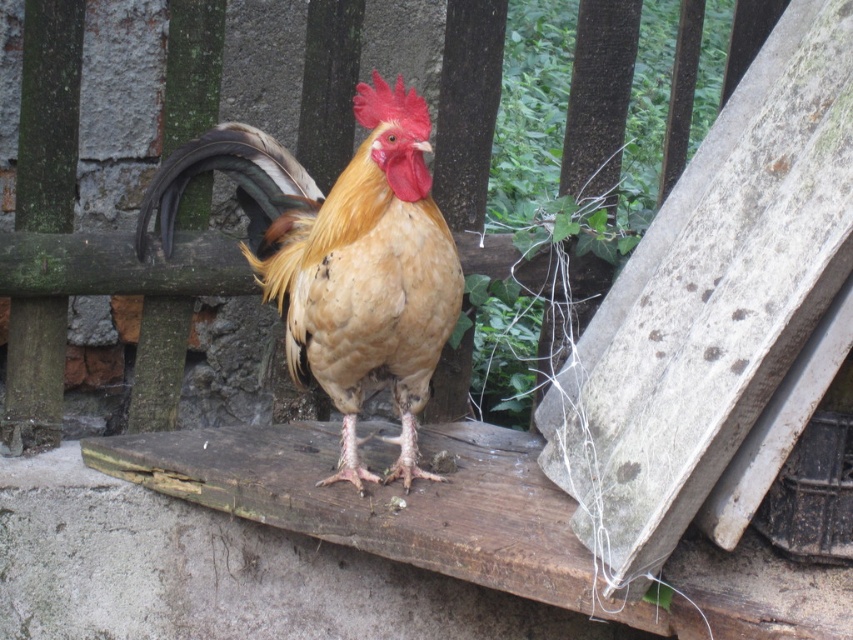
Question: In this image, where is golden feathered rooster at center located relative to wooden at center?

Choices:
 (A) below
 (B) above

Answer: (A)

Question: Which point is farther to the camera?

Choices:
 (A) golden feathered rooster at center
 (B) wooden at center

Answer: (B)

Question: Does golden feathered rooster at center appear on the right side of wooden at center?

Choices:
 (A) no
 (B) yes

Answer: (A)

Question: Which point appears farthest from the camera in this image?

Choices:
 (A) (164, 248)
 (B) (483, 176)

Answer: (B)

Question: Can you confirm if golden feathered rooster at center is positioned below wooden at center?

Choices:
 (A) no
 (B) yes

Answer: (B)